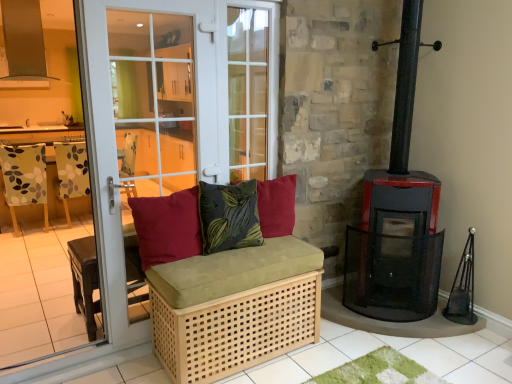
I want to click on free spot in front of black metal wood burning stove at right, so click(x=391, y=356).